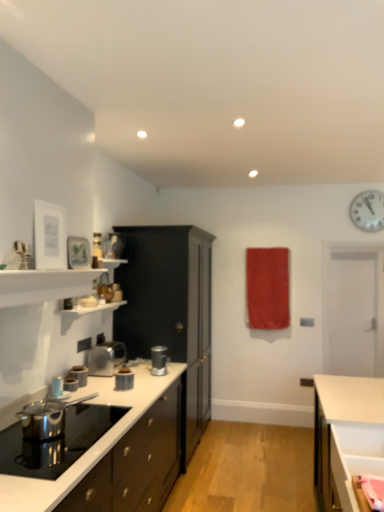
Question: Looking at their shapes, would you say metallic silver kettle at left, the 1th kitchen appliance in the left-to-right sequence, is wider or thinner than metallic silver toaster at left, placed as the second kitchen appliance when sorted from front to back?

Choices:
 (A) thin
 (B) wide

Answer: (A)

Question: Does point (56, 388) appear closer or farther from the camera than point (71, 376)?

Choices:
 (A) farther
 (B) closer

Answer: (B)

Question: Which object is positioned closest to the metallic silver toaster at left, the fourth kitchen appliance positioned from the front?

Choices:
 (A) metallic silver toaster at center, which is the fourth kitchen appliance from left to right
 (B) metallic silver kettle at left, the 1th kitchen appliance in the left-to-right sequence
 (C) glossy dark wood cabinet at lower left, the first cabinetry from the front
 (D) satin silver blender at center, which is counted as the 1th kitchen appliance, starting from the back
 (E) polished stainless steel kettle at lower left, which appears as the 2th appliance when viewed from the back

Answer: (B)

Question: Which of these objects is positioned closest to the glossy dark wood cabinet at lower left, the first cabinetry from the front?

Choices:
 (A) polished stainless steel kettle at lower left, which ranks as the first appliance in front-to-back order
 (B) metallic silver kettle at left, positioned as the 1th kitchen appliance in front-to-back order
 (C) matte red curtain at center
 (D) white metallic clock at upper right
 (E) black matte cabinet at center, the 2th cabinetry in the front-to-back sequence

Answer: (A)